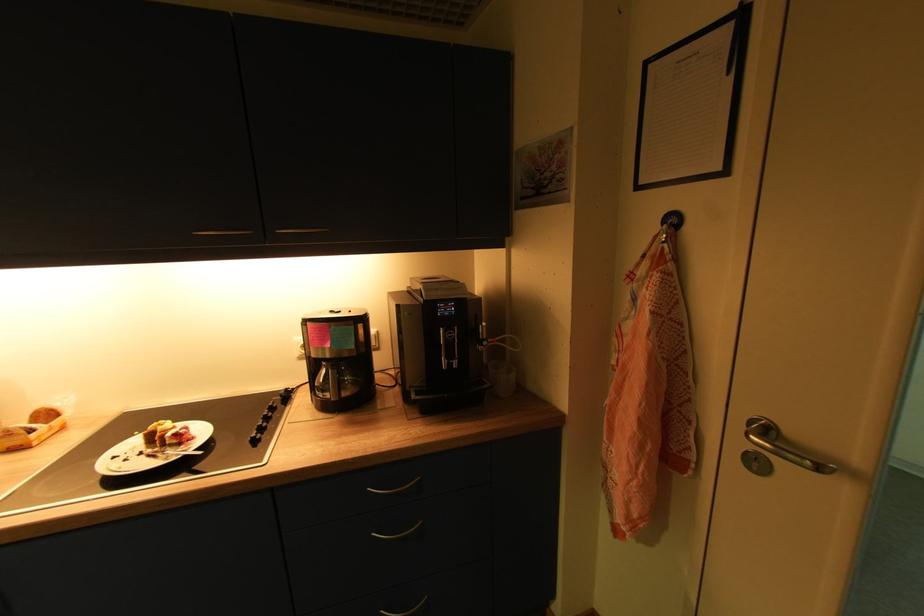
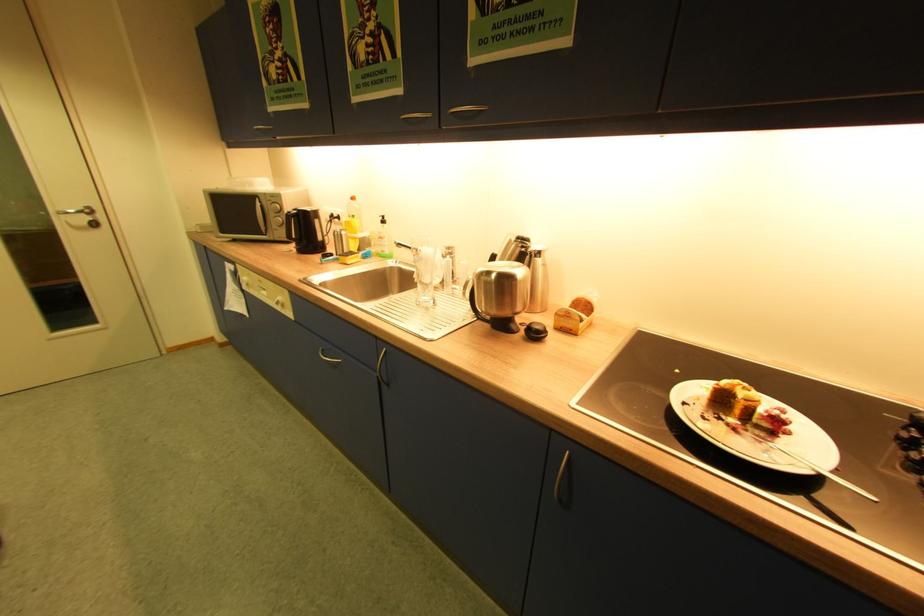
Find the pixel in the second image that matches the point at 199,439 in the first image.

(794, 434)